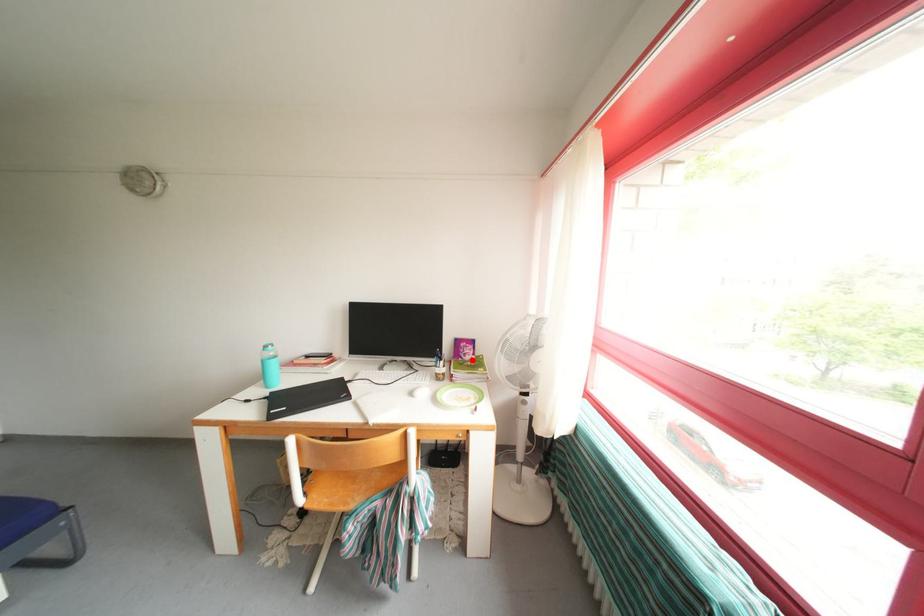
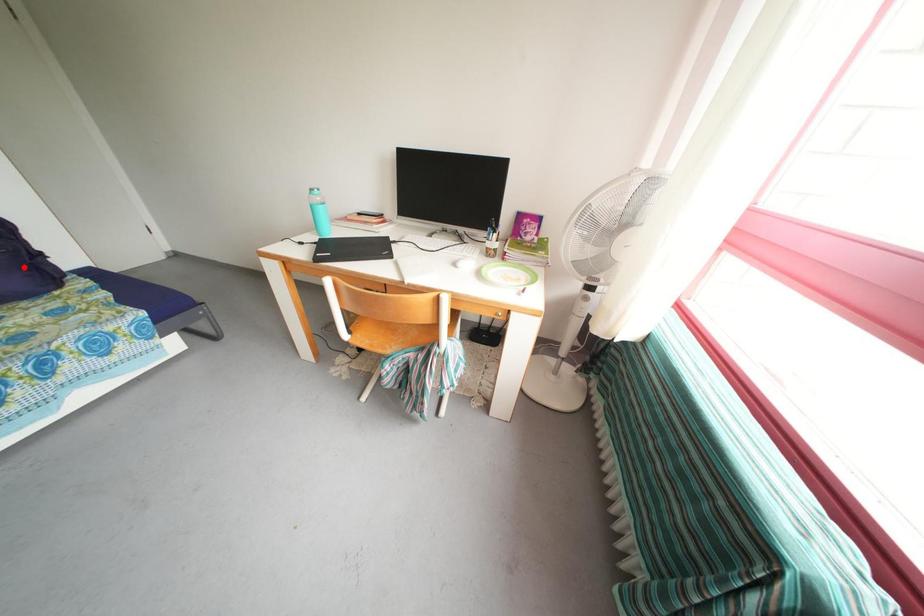
I am providing you with two images of the same scene from different viewpoints. A red point is marked on the first image and another point is marked on the second image. Is the marked point in image1 the same physical position as the marked point in image2?

No